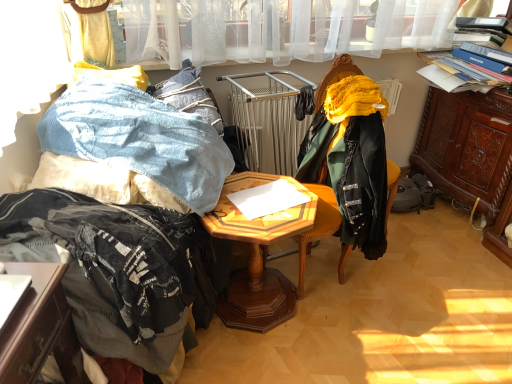
Question: Is the position of velvet green chair at center more distant than that of brown carved wood cabinet at right?

Choices:
 (A) yes
 (B) no

Answer: (B)

Question: Could you tell me if velvet green chair at center is turned towards brown carved wood cabinet at right?

Choices:
 (A) no
 (B) yes

Answer: (A)

Question: Would you say velvet green chair at center contains brown carved wood cabinet at right?

Choices:
 (A) yes
 (B) no

Answer: (B)

Question: Does velvet green chair at center lie in front of brown carved wood cabinet at right?

Choices:
 (A) no
 (B) yes

Answer: (B)

Question: From the image's perspective, would you say velvet green chair at center is positioned over brown carved wood cabinet at right?

Choices:
 (A) no
 (B) yes

Answer: (A)

Question: Can you confirm if velvet green chair at center is smaller than brown carved wood cabinet at right?

Choices:
 (A) no
 (B) yes

Answer: (B)

Question: Is denim fabric at left far away from fuzzy black blanket at left?

Choices:
 (A) no
 (B) yes

Answer: (A)

Question: Can you confirm if denim fabric at left is wider than fuzzy black blanket at left?

Choices:
 (A) yes
 (B) no

Answer: (B)

Question: Is denim fabric at left to the left of fuzzy black blanket at left from the viewer's perspective?

Choices:
 (A) yes
 (B) no

Answer: (B)

Question: Is denim fabric at left thinner than fuzzy black blanket at left?

Choices:
 (A) yes
 (B) no

Answer: (A)

Question: Is denim fabric at left facing towards fuzzy black blanket at left?

Choices:
 (A) yes
 (B) no

Answer: (A)

Question: From the image's perspective, is denim fabric at left under fuzzy black blanket at left?

Choices:
 (A) no
 (B) yes

Answer: (A)

Question: Can you confirm if velvet green chair at center is thinner than woodenobject at center?

Choices:
 (A) no
 (B) yes

Answer: (B)